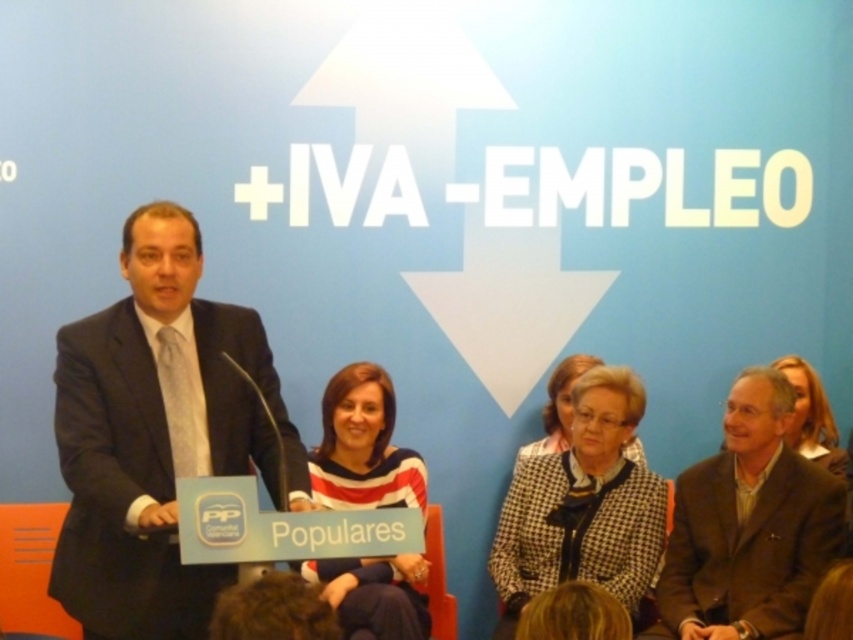
Is brown woolen suit at center shorter than black houndstooth coat at center?

Indeed, brown woolen suit at center has a lesser height compared to black houndstooth coat at center.

Locate an element on the screen. brown woolen suit at center is located at coordinates (749, 525).

The width and height of the screenshot is (853, 640). I want to click on brown woolen suit at center, so click(749, 525).

Which is above, dark gray suit at left or striped fabric shirt at center?

dark gray suit at left is higher up.

Is point (262, 385) farther from viewer compared to point (408, 492)?

No.

Locate an element on the screen. The image size is (853, 640). dark gray suit at left is located at coordinates (155, 435).

Can you confirm if dark gray suit at left is positioned above smooth beige blazer at center?

Correct, dark gray suit at left is located above smooth beige blazer at center.

The height and width of the screenshot is (640, 853). What do you see at coordinates (155, 435) in the screenshot? I see `dark gray suit at left` at bounding box center [155, 435].

I want to click on dark gray suit at left, so click(x=155, y=435).